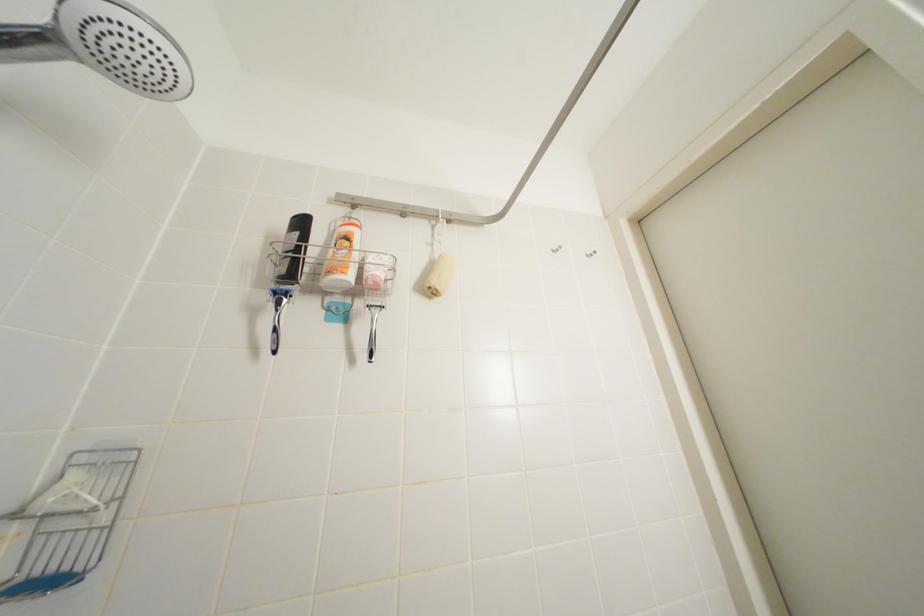
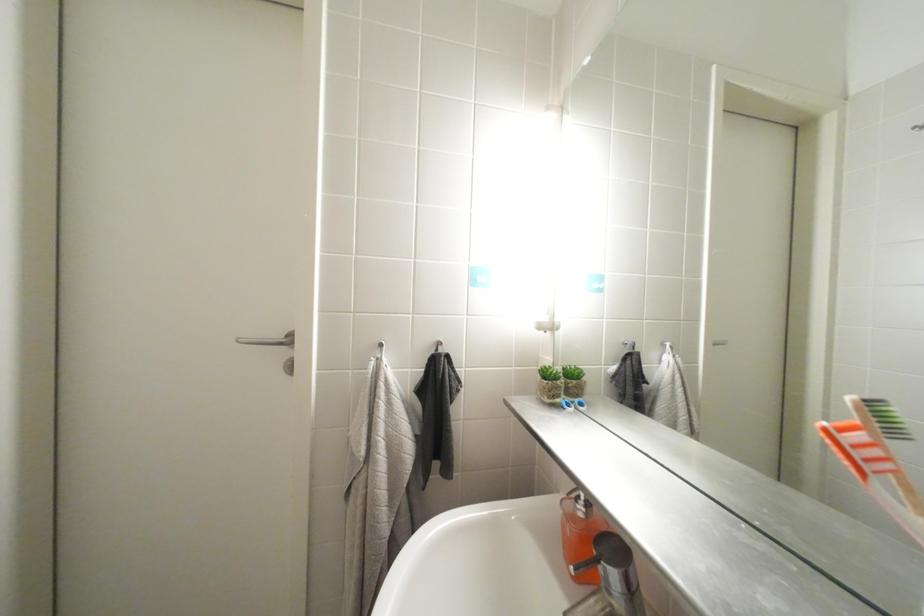
Question: Based on the continuous images, in which direction is the camera rotating? Reply with the corresponding letter.

Choices:
 (A) Left
 (B) Right
 (C) Up
 (D) Down

Answer: (B)